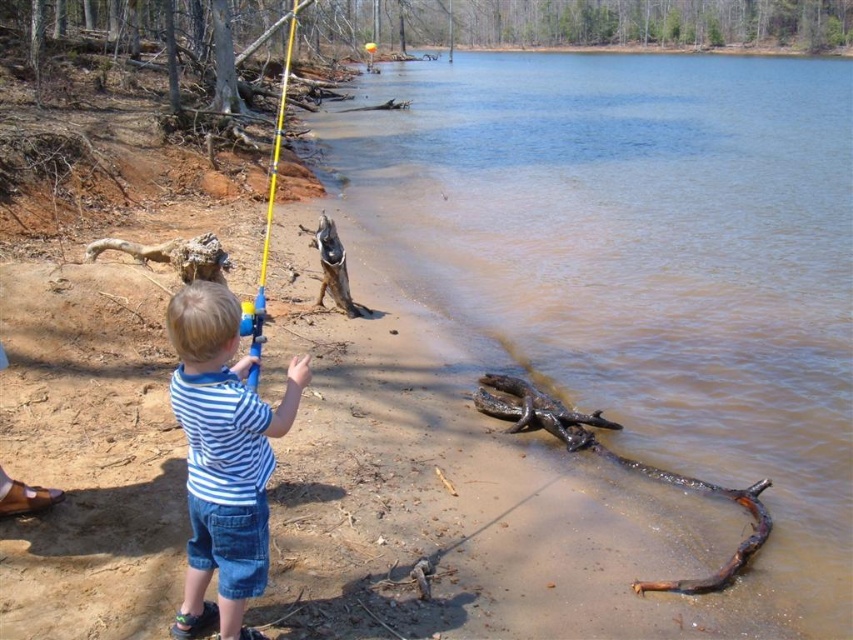
Question: Which of the following is the closest to the observer?

Choices:
 (A) blue striped shirt at center
 (B) brown muddy water at lower center
 (C) brown rough log at lower right
 (D) yellow plastic fishing pole at center

Answer: (A)

Question: Where is brown muddy water at lower center located in relation to yellow plastic fishing pole at center in the image?

Choices:
 (A) below
 (B) above

Answer: (A)

Question: Does brown rough log at lower right appear on the left side of yellow plastic fishing pole at center?

Choices:
 (A) yes
 (B) no

Answer: (B)

Question: Does brown rough log at lower right have a lesser width compared to yellow plastic fishing pole at center?

Choices:
 (A) no
 (B) yes

Answer: (B)

Question: Considering the real-world distances, which object is closest to the brown muddy water at lower center?

Choices:
 (A) brown rough log at lower right
 (B) blue striped shirt at center

Answer: (B)

Question: Which object appears closest to the camera in this image?

Choices:
 (A) blue striped shirt at center
 (B) brown muddy water at lower center

Answer: (A)